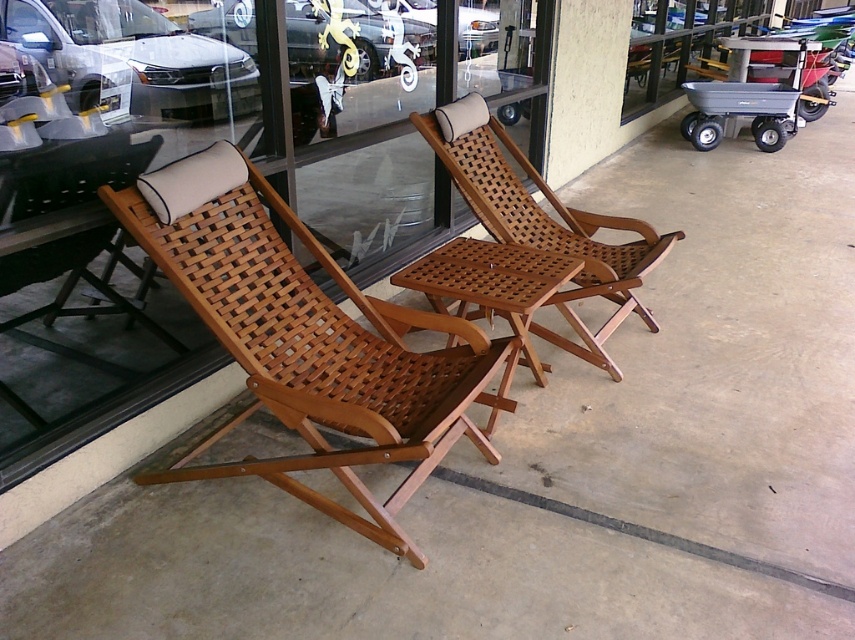
You are a delivery person standing at the entrance of the building. You need to place a package on the wooden woven chair at left. Can you reach the chair without moving closer than 1.5 meters from it?

The wooden woven chair at left is 1.70 meters away from the camera, so you can place the package without moving closer than 1.5 meters since the distance is sufficient.

You are standing at the point marked as point (304, 339) in the image. What object are you directly in front of?

You are directly in front of the wooden woven chair at left.